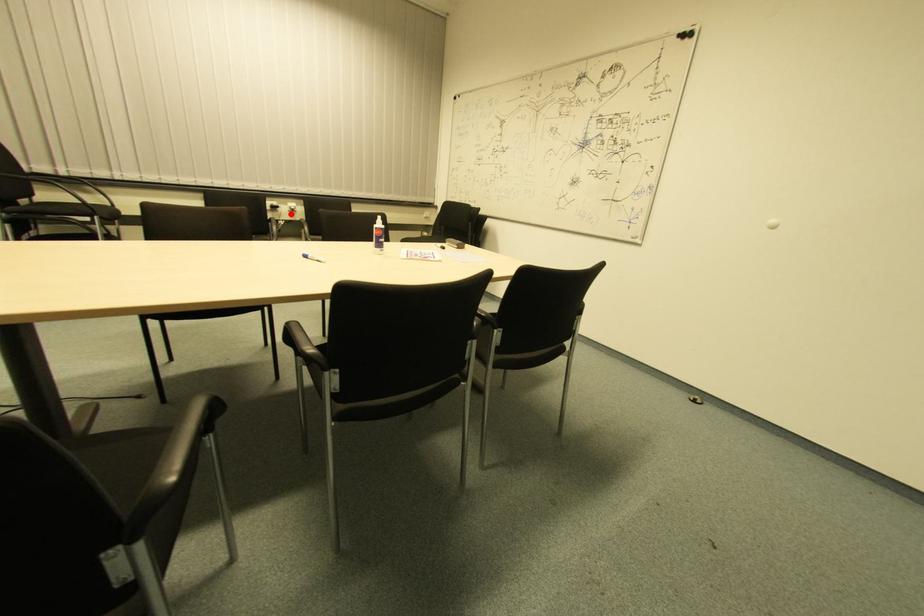
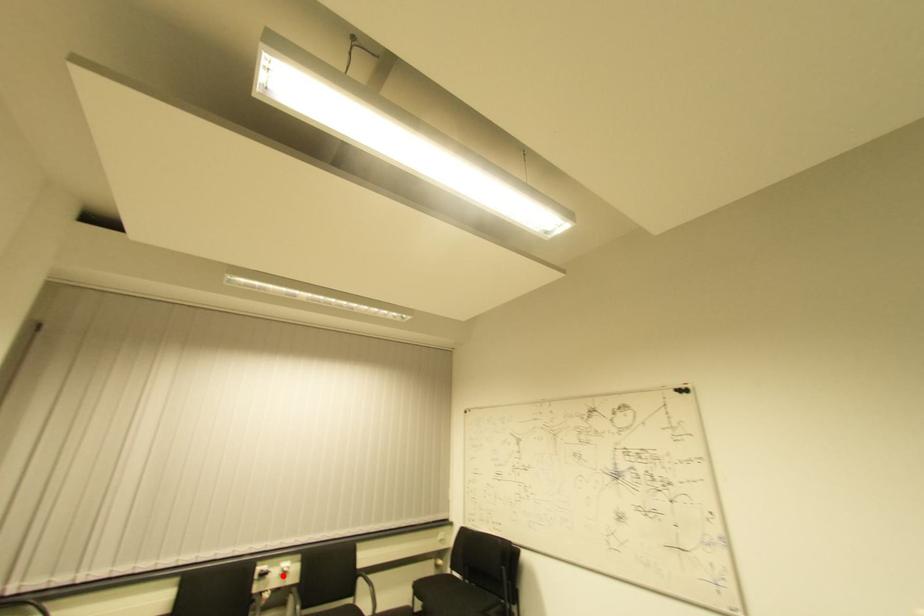
I am providing you with two images of the same scene from different viewpoints. A red point is marked on the first image and another point is marked on the second image. Are the points marked in image1 and image2 representing the same 3D position?

Yes